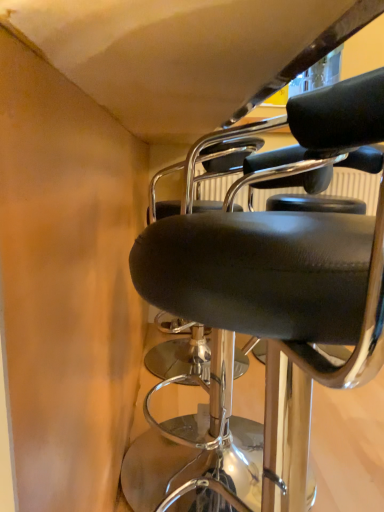
This screenshot has height=512, width=384. Describe the element at coordinates (264, 314) in the screenshot. I see `black leather chair at center` at that location.

In order to click on black leather chair at center in this screenshot , I will do `click(264, 314)`.

Locate an element on the screen. black leather chair at center is located at coordinates (264, 314).